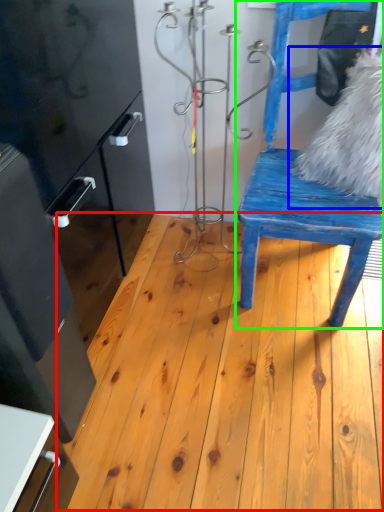
Question: Based on their relative distances, which object is farther from hardwood (highlighted by a red box)? Choose from animal (highlighted by a blue box) and chair (highlighted by a green box).

Choices:
 (A) animal
 (B) chair

Answer: (A)